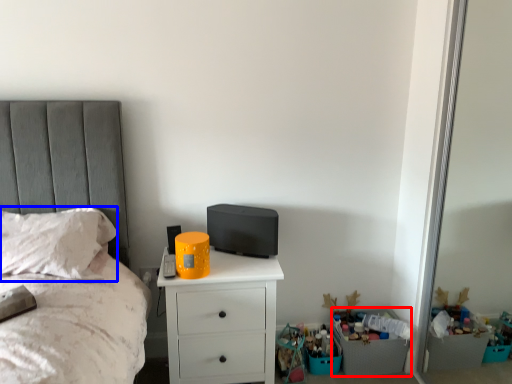
Question: Which object appears closest to the camera in this image, crate (highlighted by a red box) or pillow (highlighted by a blue box)?

Choices:
 (A) crate
 (B) pillow

Answer: (B)